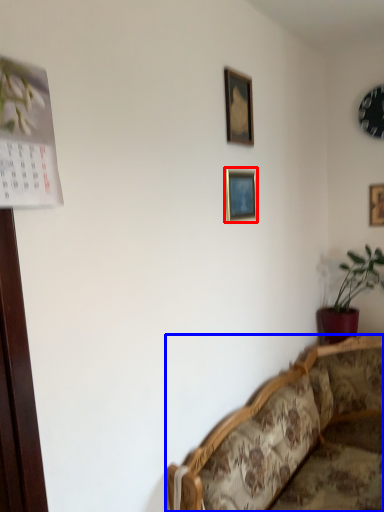
Question: Which object is further to the camera taking this photo, picture frame (highlighted by a red box) or studio couch (highlighted by a blue box)?

Choices:
 (A) picture frame
 (B) studio couch

Answer: (A)